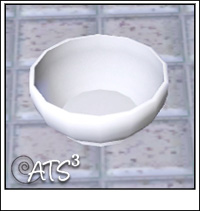
Identify the location of white bowl. This screenshot has height=211, width=200. (114, 126).